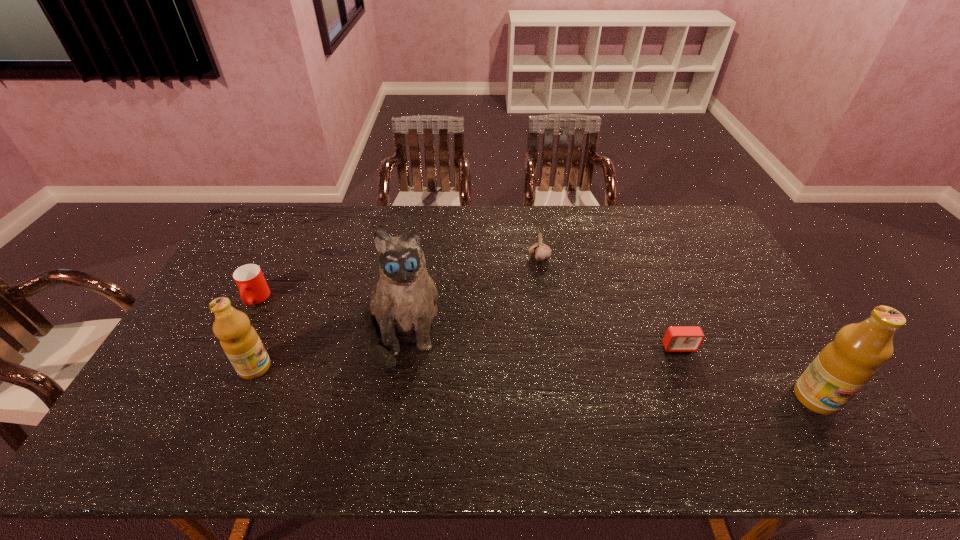
This screenshot has width=960, height=540. I want to click on location for an additional olive_oil to make spacing equal, so click(527, 382).